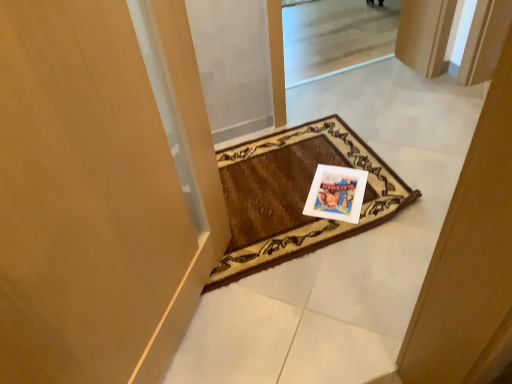
The height and width of the screenshot is (384, 512). Find the location of `free space above white paper postcard at center (from a real-world perspective)`. free space above white paper postcard at center (from a real-world perspective) is located at coordinates (338, 183).